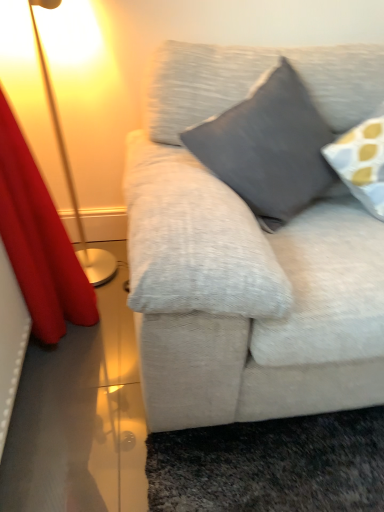
Question: Would you say red velvet curtain at left is inside or outside dark gray fabric pillow at center?

Choices:
 (A) outside
 (B) inside

Answer: (A)

Question: Is point (1, 96) closer or farther from the camera than point (292, 189)?

Choices:
 (A) closer
 (B) farther

Answer: (B)

Question: Which object is the farthest from the red velvet curtain at left?

Choices:
 (A) metallic gold lamp at left
 (B) dark gray fabric pillow at center

Answer: (B)

Question: Which object is positioned farthest from the red velvet curtain at left?

Choices:
 (A) dark gray fabric pillow at center
 (B) metallic gold lamp at left

Answer: (A)